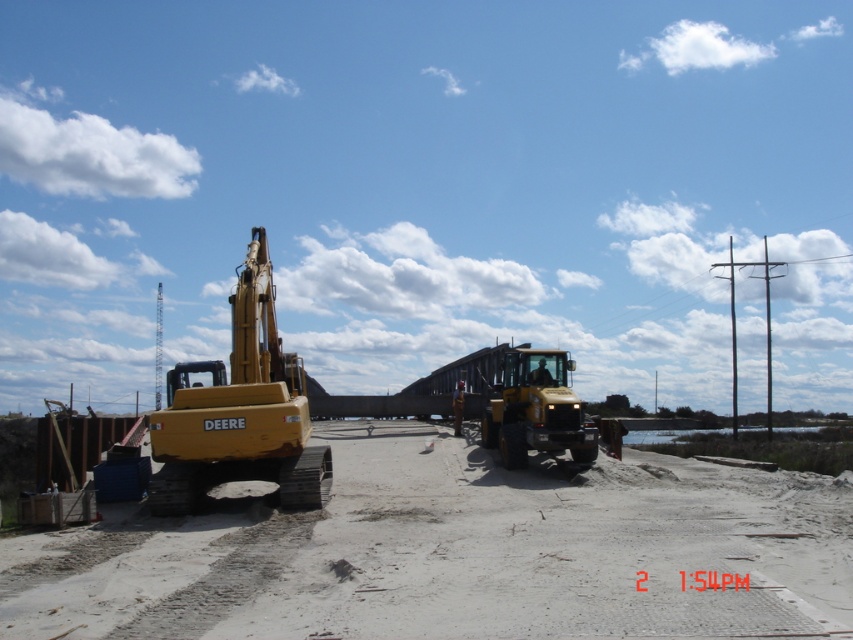
You are a construction worker needing to move a heavy load across the sandy area. Which machine, the yellow rubber tracked excavator at left or the yellow metallic tractor at center, would be more suitable for this task based on their sizes?

The yellow rubber tracked excavator at left has a larger size compared to the yellow metallic tractor at center, making it more suitable for moving heavy loads across the sandy area due to its greater capacity.

You are a construction worker standing at the yellow John Deere excavator on the left. You need to reach the dirt track at center marked by point (451, 552). Which direction should you walk to get there?

You should walk towards the center from the yellow John Deere excavator on the left to reach the dirt track at center marked by point (451, 552).

Looking at this image, you are a delivery driver who needs to transport supplies to the construction site. You see the dirt track at center and the yellow metallic tractor at center. Which path should you take to avoid the tractor?

The dirt track at center is located below the yellow metallic tractor at center, so you should take the dirt track at center to avoid the tractor.